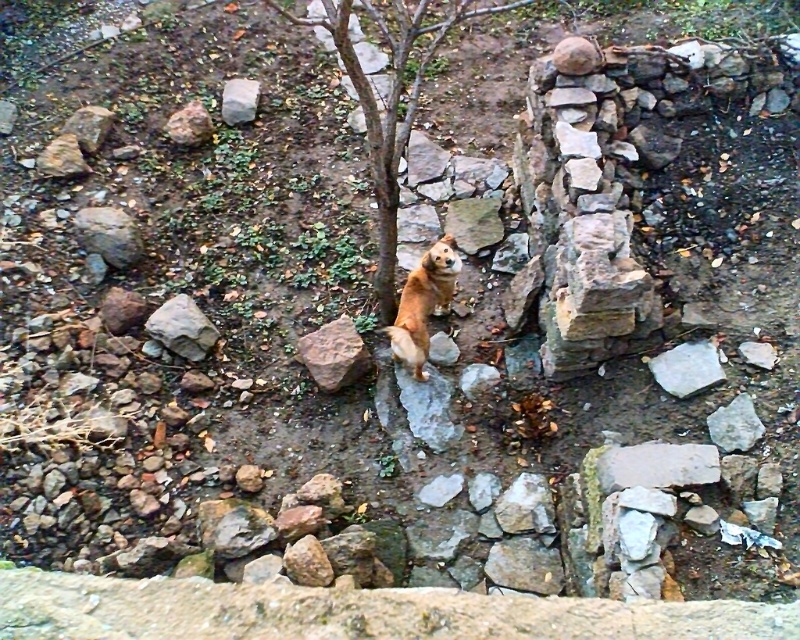
Looking at this image, you are a hiker who needs to place a small backpack between the gray rough rock at left and the white smooth rock at lower right. Which rock should you place it closer to if you want the backpack to be more visible against the background?

The gray rough rock at left is larger than the white smooth rock at lower right. Placing the backpack closer to the larger gray rough rock at left would make it more visible against the background.